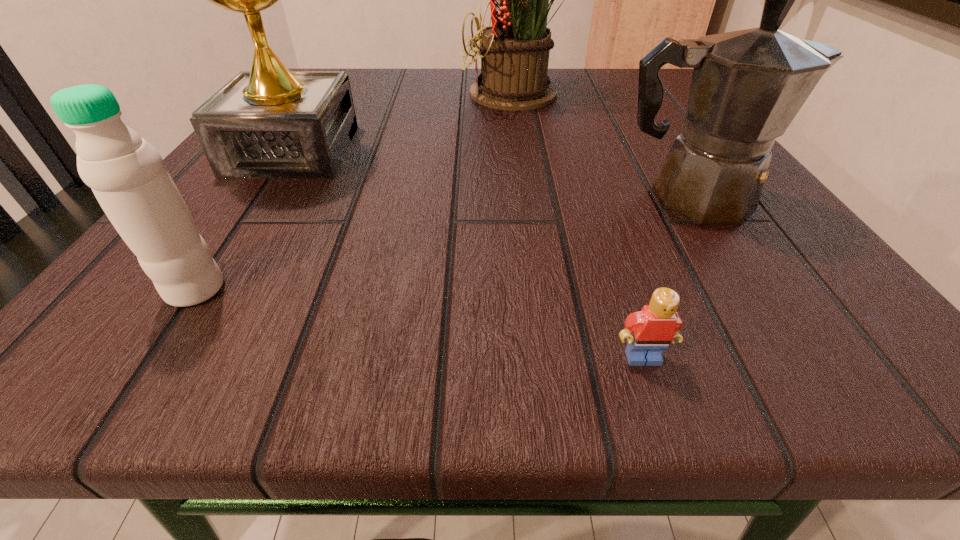
Identify the location of flower arrangement. (514, 51).

Identify the location of award. The image size is (960, 540). (269, 122).

What are the coordinates of `coffeepot` in the screenshot? It's located at (747, 86).

Image resolution: width=960 pixels, height=540 pixels. In order to click on water bottle in this screenshot , I will do `click(127, 175)`.

In order to click on the second shortest object in this screenshot , I will do `click(127, 175)`.

Where is `Lego`? This screenshot has width=960, height=540. Lego is located at coordinates (654, 327).

Identify the location of the nearest object. (654, 327).

Identify the location of vacant point located in front of the flower arrangement with the fan visible. The height and width of the screenshot is (540, 960). (294, 94).

Find the location of a particular element. The image size is (960, 540). vacant position located in front of the flower arrangement with the fan visible is located at coordinates (415, 94).

I want to click on free space located 0.150m in front of the flower arrangement with the fan visible, so click(383, 94).